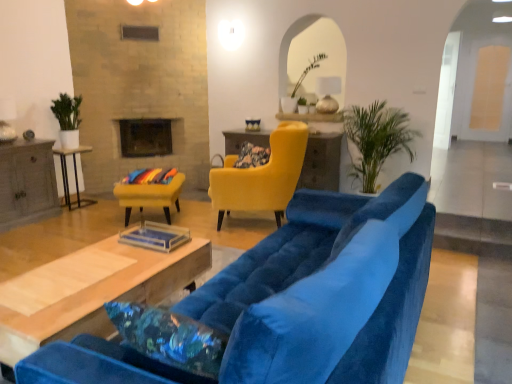
Question: Considering the positions of black glass fireplace at upper center and velvet yellow armchair at center, the first chair in the left-to-right sequence, in the image, is black glass fireplace at upper center bigger or smaller than velvet yellow armchair at center, the first chair in the left-to-right sequence,?

Choices:
 (A) big
 (B) small

Answer: (B)

Question: Is point (154, 135) positioned closer to the camera than point (135, 192)?

Choices:
 (A) closer
 (B) farther

Answer: (B)

Question: Considering the real-world distances, which object is farthest from the wooden coffee table at center, marked as the second table in a right-to-left arrangement?

Choices:
 (A) velvet blue couch at center
 (B) matte yellow armchair at center, the 1th chair positioned from the right
 (C) green leafy plant at upper center
 (D) gray wood side table at left, marked as the third table in a back-to-front arrangement
 (E) floral fabric pillow at center

Answer: (C)

Question: Which object is positioned closest to the green leafy plant at upper center?

Choices:
 (A) velvet yellow armchair at center, the first chair in the left-to-right sequence
 (B) white glossy side table at left, arranged as the 2th table when viewed from the back
 (C) green leafy plant at right
 (D) wooden coffee table at center, the 3th table positioned from the left
 (E) black glass fireplace at upper center

Answer: (C)